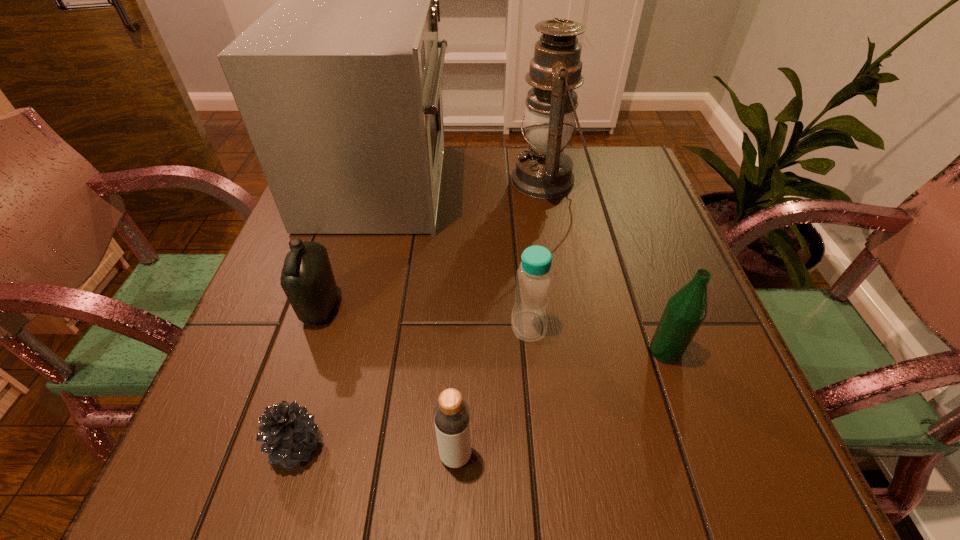
You are a GUI agent. You are given a task and a screenshot of the screen. Output one action in this format:
    pyautogui.click(x=<x>, y=<y>)
    Task: Click on the free spot located 0.050m on the right of the rightmost object
    The height and width of the screenshot is (540, 960).
    Given the screenshot: What is the action you would take?
    pyautogui.click(x=711, y=351)

Find the location of `vacant space positioned on the back of the second bottle from right to left`. vacant space positioned on the back of the second bottle from right to left is located at coordinates (516, 195).

Locate an element on the screen. This screenshot has height=540, width=960. free space located 0.270m on the right of the leftmost bottle is located at coordinates (481, 308).

Identify the location of free spot located 0.330m on the back of the nearest bottle. Image resolution: width=960 pixels, height=540 pixels. (463, 280).

Find the location of a particular element. This screenshot has height=540, width=960. free space located 0.180m on the right of the pinecone is located at coordinates (445, 446).

The image size is (960, 540). I want to click on toaster oven that is at the far edge, so click(338, 84).

The width and height of the screenshot is (960, 540). What are the coordinates of `oil lamp that is at the far edge` in the screenshot? It's located at [544, 171].

At what (x,y) coordinates should I click in order to perform the action: click on bottle present at the near edge. Please return your answer as a coordinate pair (x, y). This screenshot has height=540, width=960. Looking at the image, I should click on (451, 414).

In order to click on pinecone positioned at the near edge in this screenshot , I will do pyautogui.click(x=288, y=431).

The height and width of the screenshot is (540, 960). I want to click on toaster oven located in the left edge section of the desktop, so click(x=338, y=84).